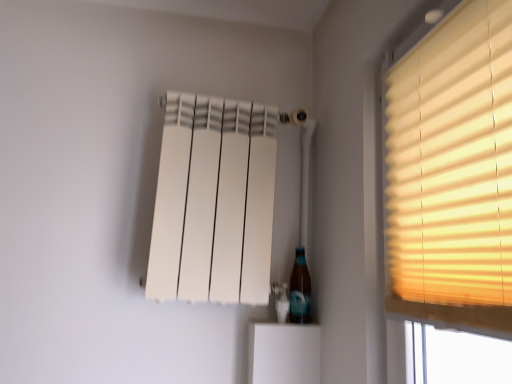
Question: From a real-world perspective, is white matte radiator at upper center on translucent glass bottle at lower right?

Choices:
 (A) no
 (B) yes

Answer: (B)

Question: Can you confirm if white matte radiator at upper center is positioned to the left of translucent glass bottle at lower right?

Choices:
 (A) yes
 (B) no

Answer: (A)

Question: Does white matte radiator at upper center come in front of translucent glass bottle at lower right?

Choices:
 (A) yes
 (B) no

Answer: (A)

Question: Is white matte radiator at upper center shorter than translucent glass bottle at lower right?

Choices:
 (A) yes
 (B) no

Answer: (B)

Question: From the image's perspective, would you say white matte radiator at upper center is positioned over translucent glass bottle at lower right?

Choices:
 (A) yes
 (B) no

Answer: (A)

Question: Can you confirm if white matte radiator at upper center is taller than translucent glass bottle at lower right?

Choices:
 (A) no
 (B) yes

Answer: (B)

Question: Considering the relative sizes of matte yellow blinds at right and translucent glass bottle at lower right in the image provided, is matte yellow blinds at right bigger than translucent glass bottle at lower right?

Choices:
 (A) yes
 (B) no

Answer: (A)

Question: From the image's perspective, is matte yellow blinds at right over translucent glass bottle at lower right?

Choices:
 (A) yes
 (B) no

Answer: (A)

Question: From the image's perspective, is matte yellow blinds at right located beneath translucent glass bottle at lower right?

Choices:
 (A) no
 (B) yes

Answer: (A)

Question: Is matte yellow blinds at right outside translucent glass bottle at lower right?

Choices:
 (A) no
 (B) yes

Answer: (B)

Question: Does matte yellow blinds at right have a smaller size compared to translucent glass bottle at lower right?

Choices:
 (A) yes
 (B) no

Answer: (B)

Question: Is matte yellow blinds at right thinner than translucent glass bottle at lower right?

Choices:
 (A) no
 (B) yes

Answer: (B)

Question: Can you confirm if translucent glass bottle at lower right is thinner than matte yellow blinds at right?

Choices:
 (A) no
 (B) yes

Answer: (A)